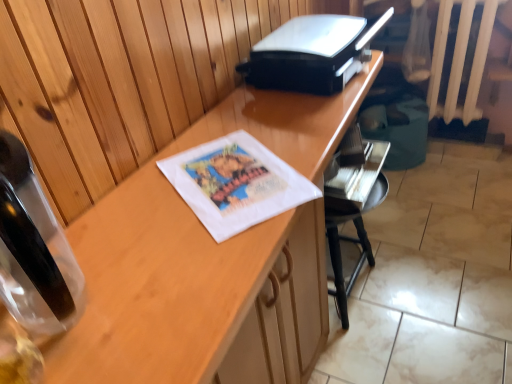
Identify the location of free space above wooden desk at center (from a real-world perspective). The height and width of the screenshot is (384, 512). (234, 171).